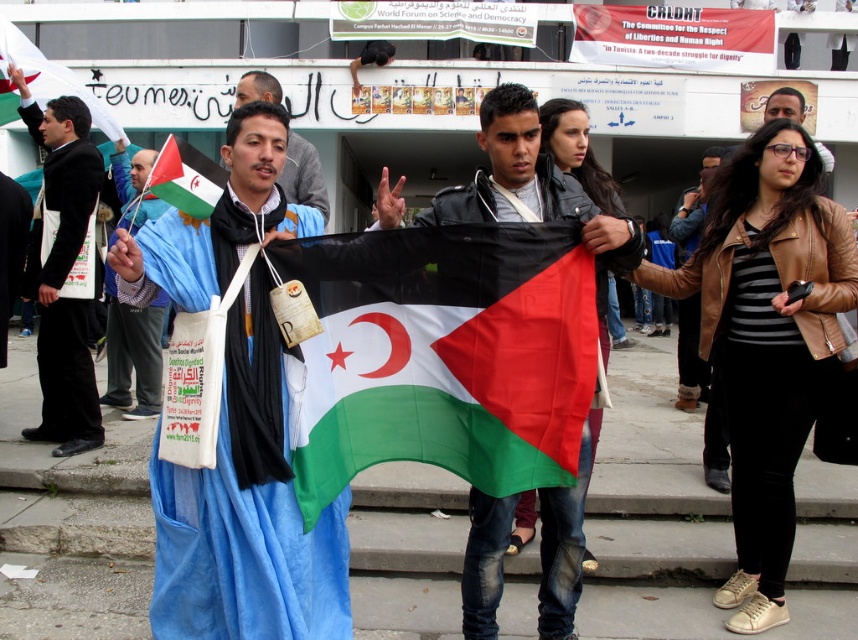
You are organizing a charity event and need to place a 30 cm wide donation box next to the black fabric bag at left and the blue fabric at center. Which object should you place the donation box next to if you want to ensure it fits without overlapping?

The black fabric bag at left is wider than the blue fabric at center. Since the donation box is 30 cm wide, placing it next to the black fabric bag at left would be more suitable as there is more space available compared to the narrower blue fabric at center.